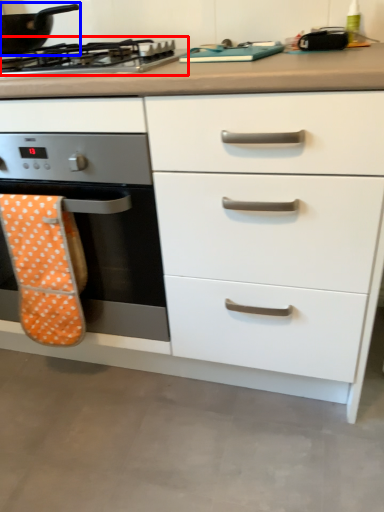
Question: Which object appears farthest to the camera in this image, gas stove (highlighted by a red box) or kitchen appliance (highlighted by a blue box)?

Choices:
 (A) gas stove
 (B) kitchen appliance

Answer: (B)